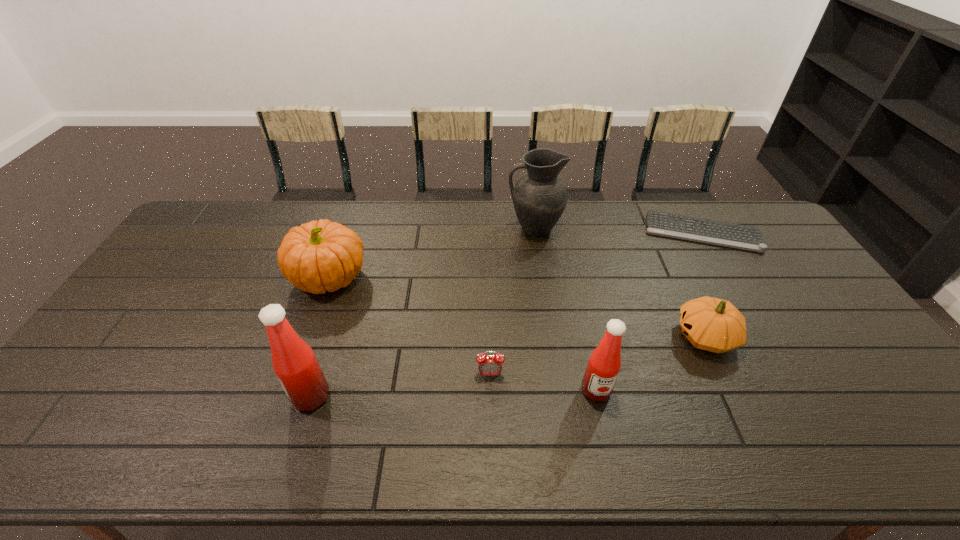
At what (x,y) coordinates should I click in order to perform the action: click on vacant space located 0.220m on the front-facing side of the taller condiment. Please return your answer as a coordinate pair (x, y). This screenshot has width=960, height=540. Looking at the image, I should click on (204, 396).

Find the location of `vacant area situated on the front-facing side of the taller condiment`. vacant area situated on the front-facing side of the taller condiment is located at coordinates (244, 396).

What are the coordinates of `vacant space located on the front-facing side of the taller condiment` in the screenshot? It's located at (172, 396).

Locate an element on the screen. The width and height of the screenshot is (960, 540). vacant region located 0.060m on the back of the computer keyboard is located at coordinates (686, 204).

Where is `blank space located 0.350m on the side of the pitcher with the handle`? This screenshot has height=540, width=960. blank space located 0.350m on the side of the pitcher with the handle is located at coordinates (408, 228).

Where is `free space located 0.070m on the side of the pitcher with the handle`? free space located 0.070m on the side of the pitcher with the handle is located at coordinates (487, 228).

This screenshot has width=960, height=540. Find the location of `vacant space located on the side of the pitcher with the handle`. vacant space located on the side of the pitcher with the handle is located at coordinates (433, 228).

This screenshot has height=540, width=960. I want to click on free point located 0.280m on the surface of the fourth shortest object, so click(x=457, y=278).

The height and width of the screenshot is (540, 960). I want to click on vacant region located 0.070m on the side of the fifth tallest object with the carved face, so click(x=649, y=336).

This screenshot has width=960, height=540. Identify the location of blank space located 0.270m on the side of the fifth tallest object with the carved face. (577, 336).